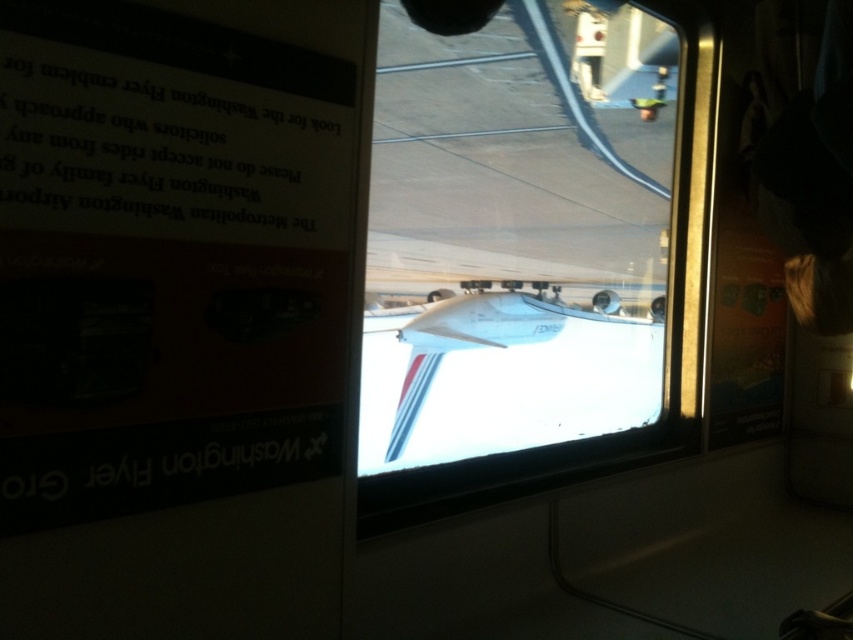
Question: Is transparent glass airplane window at center smaller than white glossy airplane at center?

Choices:
 (A) yes
 (B) no

Answer: (A)

Question: Is transparent glass airplane window at center further to the viewer compared to white glossy airplane at center?

Choices:
 (A) yes
 (B) no

Answer: (A)

Question: Which object is closer to the camera taking this photo?

Choices:
 (A) transparent glass airplane window at center
 (B) white glossy airplane at center

Answer: (B)

Question: Observing the image, what is the correct spatial positioning of transparent glass airplane window at center in reference to white glossy airplane at center?

Choices:
 (A) below
 (B) above

Answer: (B)

Question: Which point appears farthest from the camera in this image?

Choices:
 (A) click(387, 448)
 (B) click(492, 451)

Answer: (A)